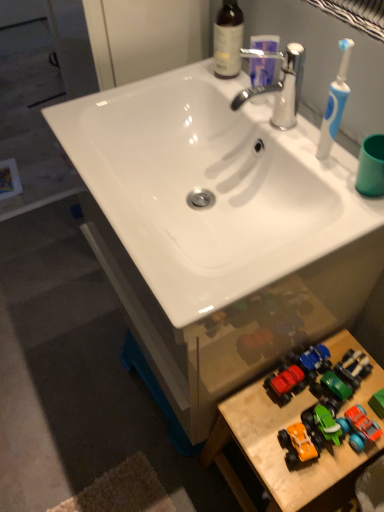
Identify the location of free point behind chrome metallic faucet at upper center. The height and width of the screenshot is (512, 384). (228, 94).